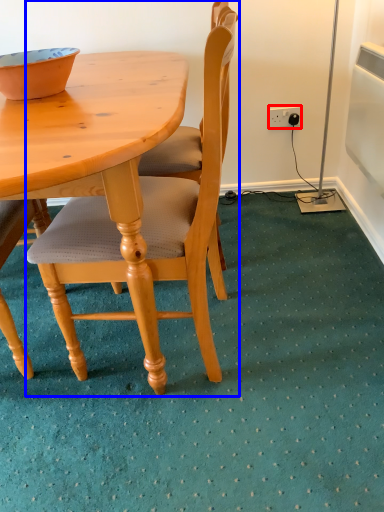
Question: Which point is closer to the camera, power outlet (highlighted by a red box) or chair (highlighted by a blue box)?

Choices:
 (A) power outlet
 (B) chair

Answer: (B)